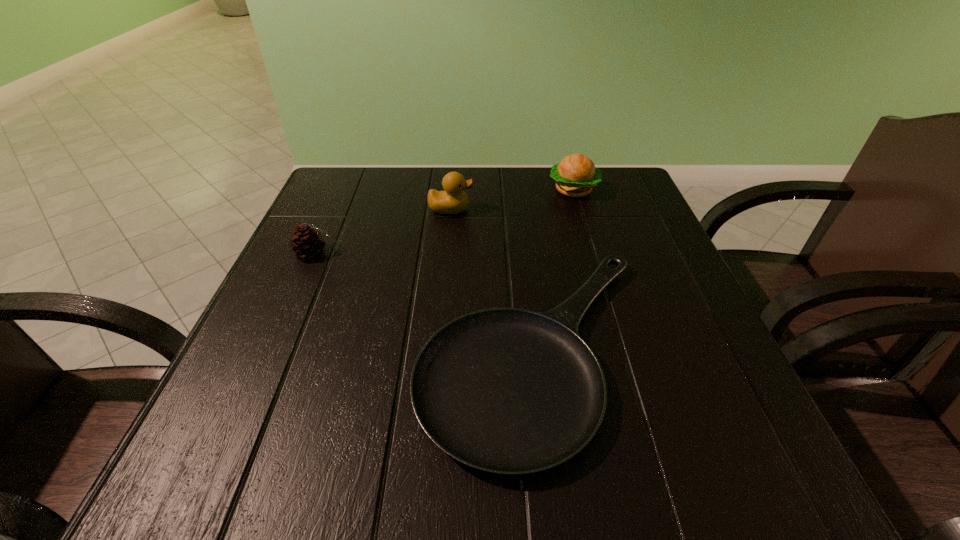
Locate an element on the screen. duckling positioned at the far edge is located at coordinates (453, 200).

The image size is (960, 540). In order to click on hamburger located at the far edge in this screenshot , I will do `click(576, 174)`.

Find the location of `object situated at the near edge`. object situated at the near edge is located at coordinates (510, 391).

At what (x,y) coordinates should I click in order to perform the action: click on object at the left edge. Please return your answer as a coordinate pair (x, y). This screenshot has height=540, width=960. Looking at the image, I should click on (307, 242).

You are a GUI agent. You are given a task and a screenshot of the screen. Output one action in this format:
    pyautogui.click(x=<x>, y=<y>)
    Task: Click on the hamburger located in the right edge section of the desktop
    The height and width of the screenshot is (540, 960).
    Given the screenshot: What is the action you would take?
    pyautogui.click(x=576, y=174)

Where is `frying pan situated at the right edge`? The height and width of the screenshot is (540, 960). frying pan situated at the right edge is located at coordinates (510, 391).

Where is `object at the far right corner`? The image size is (960, 540). object at the far right corner is located at coordinates (576, 174).

At what (x,y) coordinates should I click in order to perform the action: click on object positioned at the near right corner. Please return your answer as a coordinate pair (x, y). Looking at the image, I should click on (510, 391).

This screenshot has height=540, width=960. In the image, there is a desktop. What are the coordinates of `vacant space at the far edge` in the screenshot? It's located at (516, 219).

Locate an element on the screen. The height and width of the screenshot is (540, 960). vacant space at the near edge of the desktop is located at coordinates (339, 465).